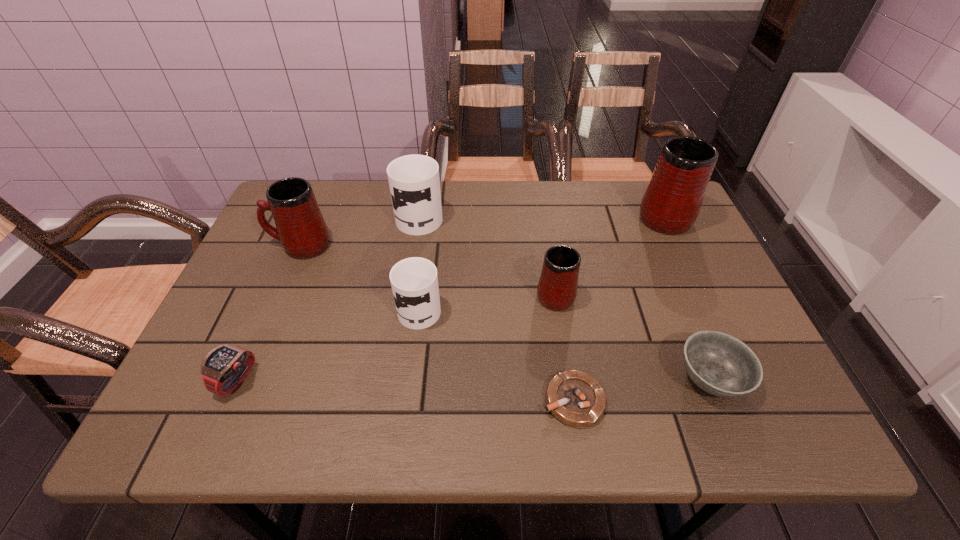
Locate an element on the screen. The image size is (960, 540). mug that stands as the third closest to the second biggest red mug is located at coordinates (557, 288).

In order to click on the second closest red mug relative to the tallest object in this screenshot , I will do `click(300, 227)`.

Locate which red mug is the second closest to the second mug from right to left. Please provide its 2D coordinates. Your answer should be formatted as a tuple, i.e. [(x, y)], where the tuple contains the x and y coordinates of a point satisfying the conditions above.

[(300, 227)]

This screenshot has width=960, height=540. In order to click on vacant position in the image that satisfies the following two spatial constraints: 1. on the handle side of the smaller white mug; 2. on the side of the second biggest red mug with the handle in this screenshot , I will do `click(427, 245)`.

Find the location of a particular element. This screenshot has height=540, width=960. vacant position in the image that satisfies the following two spatial constraints: 1. on the back side of the ashtray; 2. on the side of the second biggest red mug with the handle is located at coordinates (548, 245).

Locate an element on the screen. The height and width of the screenshot is (540, 960). blank space that satisfies the following two spatial constraints: 1. on the side of the second smallest red mug with the handle; 2. on the handle side of the smaller white mug is located at coordinates (275, 306).

Identify the location of free point that satisfies the following two spatial constraints: 1. on the side of the smallest red mug with the handle; 2. on the side of the leftmost red mug with the handle. (547, 245).